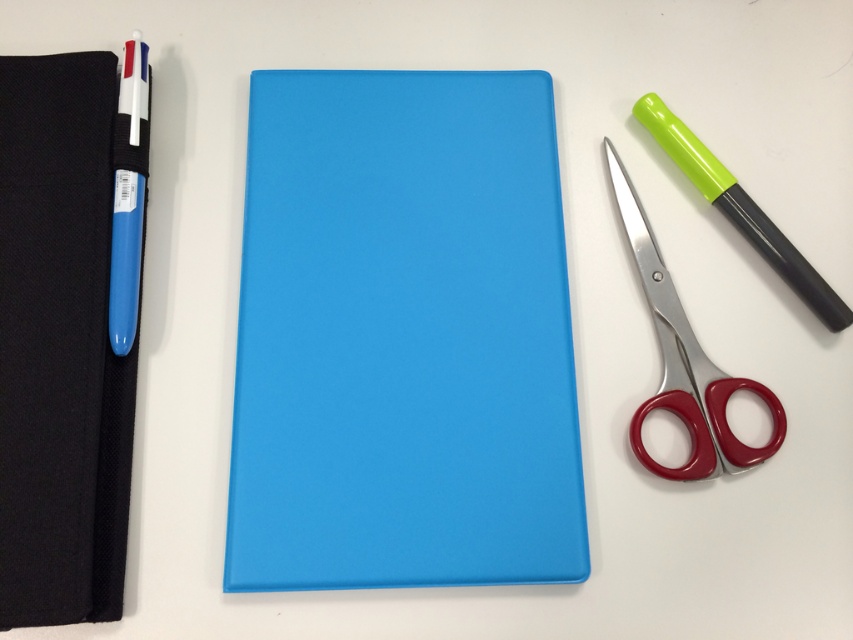
You are organizing office supplies on a shelf and need to place the matte blue notebook at center and the red plastic scissors at right. If the shelf has limited vertical space, which item might not fit if the shelf is only 10 cm tall?

The matte blue notebook at center is much taller than the red plastic scissors at right. Since the shelf is only 10 cm tall, the matte blue notebook at center might not fit due to its greater height compared to the scissors.

Consider the image. You are a delivery person who needs to place a package that is 33 inches long on the table where the black fabric notebook at left is located. Can the package fit on the table without overlapping the notebook?

The black fabric notebook at left is 32.75 inches away from the camera, so the package that is 33 inches long may not fit on the table without overlapping the notebook since it is slightly longer than the available space.